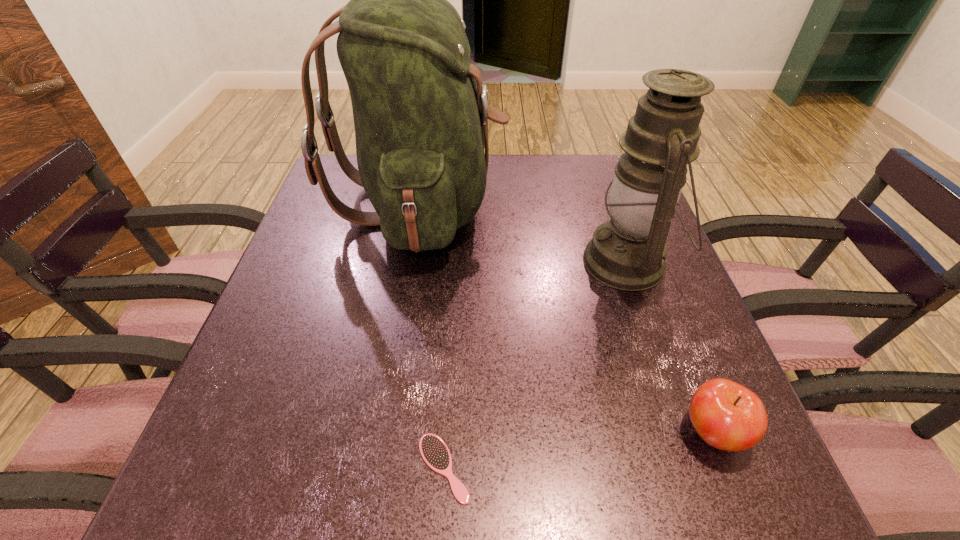
Where is `backpack`? This screenshot has height=540, width=960. backpack is located at coordinates click(420, 110).

What are the coordinates of `oil lamp` in the screenshot? It's located at (628, 252).

At what (x,y) coordinates should I click in order to perform the action: click on apple. Please return your answer as a coordinate pair (x, y). The width and height of the screenshot is (960, 540). Looking at the image, I should click on (726, 415).

The height and width of the screenshot is (540, 960). I want to click on hairbrush, so click(x=434, y=451).

The width and height of the screenshot is (960, 540). In order to click on vacant position located on the open flap of the backpack in this screenshot , I will do `click(623, 205)`.

Where is `free spot located 0.290m on the left of the oil lamp`? The height and width of the screenshot is (540, 960). free spot located 0.290m on the left of the oil lamp is located at coordinates (452, 262).

Identify the location of vacant space positioned on the back of the second shortest object. The width and height of the screenshot is (960, 540). (669, 319).

You are a GUI agent. You are given a task and a screenshot of the screen. Output one action in this format:
    pyautogui.click(x=<x>, y=<y>)
    Task: Click on the vacant space located 0.360m on the right of the hairbrush
    This screenshot has width=960, height=540.
    Given the screenshot: What is the action you would take?
    pyautogui.click(x=712, y=468)

Locate an element on the screen. This screenshot has width=960, height=540. object at the far edge is located at coordinates (420, 110).

Where is `apple situated at the near edge`? Image resolution: width=960 pixels, height=540 pixels. apple situated at the near edge is located at coordinates (726, 415).